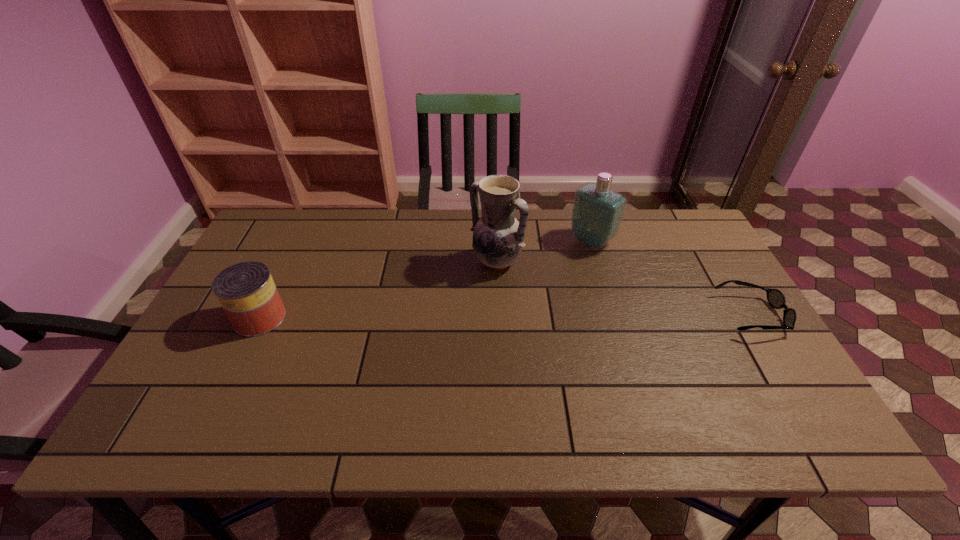
This screenshot has height=540, width=960. Identify the location of free spot on the desktop that is between the can and the sunglasses and is positioned on either side of the third object from right to left. (439, 316).

In order to click on free space on the desktop that is between the third tallest object and the sunglasses and is positioned on the front label of the third shortest object in this screenshot , I will do `click(500, 316)`.